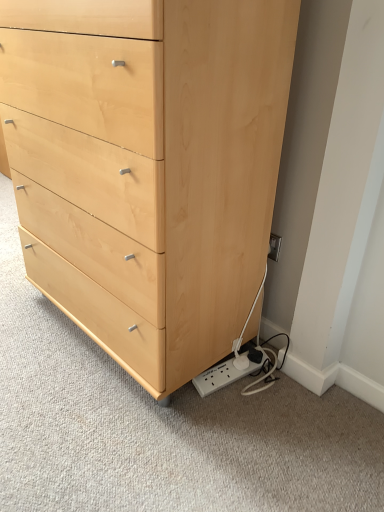
Question: Is white plastic power strip at lower right smaller than natural wood chest of drawers at lower left?

Choices:
 (A) yes
 (B) no

Answer: (A)

Question: Can you confirm if white plastic power strip at lower right is shorter than natural wood chest of drawers at lower left?

Choices:
 (A) yes
 (B) no

Answer: (A)

Question: Does white plastic power strip at lower right have a lesser width compared to natural wood chest of drawers at lower left?

Choices:
 (A) yes
 (B) no

Answer: (A)

Question: Is white plastic power strip at lower right at the right side of natural wood chest of drawers at lower left?

Choices:
 (A) yes
 (B) no

Answer: (A)

Question: Could you tell me if white plastic power strip at lower right is turned towards natural wood chest of drawers at lower left?

Choices:
 (A) yes
 (B) no

Answer: (A)

Question: From the image's perspective, is white plastic power strip at lower right beneath natural wood chest of drawers at lower left?

Choices:
 (A) yes
 (B) no

Answer: (A)

Question: From a real-world perspective, does natural wood chest of drawers at lower left stand above white plastic power strip at lower right?

Choices:
 (A) yes
 (B) no

Answer: (A)

Question: Considering the relative sizes of natural wood chest of drawers at lower left and white plastic power strip at lower right in the image provided, is natural wood chest of drawers at lower left smaller than white plastic power strip at lower right?

Choices:
 (A) yes
 (B) no

Answer: (B)

Question: Is natural wood chest of drawers at lower left taller than white plastic power strip at lower right?

Choices:
 (A) no
 (B) yes

Answer: (B)

Question: Considering the relative sizes of natural wood chest of drawers at lower left and white plastic power strip at lower right in the image provided, is natural wood chest of drawers at lower left shorter than white plastic power strip at lower right?

Choices:
 (A) no
 (B) yes

Answer: (A)

Question: Is natural wood chest of drawers at lower left in front of white plastic power strip at lower right?

Choices:
 (A) yes
 (B) no

Answer: (A)

Question: Could white plastic power strip at lower right be considered to be inside natural wood chest of drawers at lower left?

Choices:
 (A) yes
 (B) no

Answer: (B)

Question: In terms of height, does natural wood chest of drawers at lower left look taller or shorter compared to white plastic power strip at lower right?

Choices:
 (A) tall
 (B) short

Answer: (A)